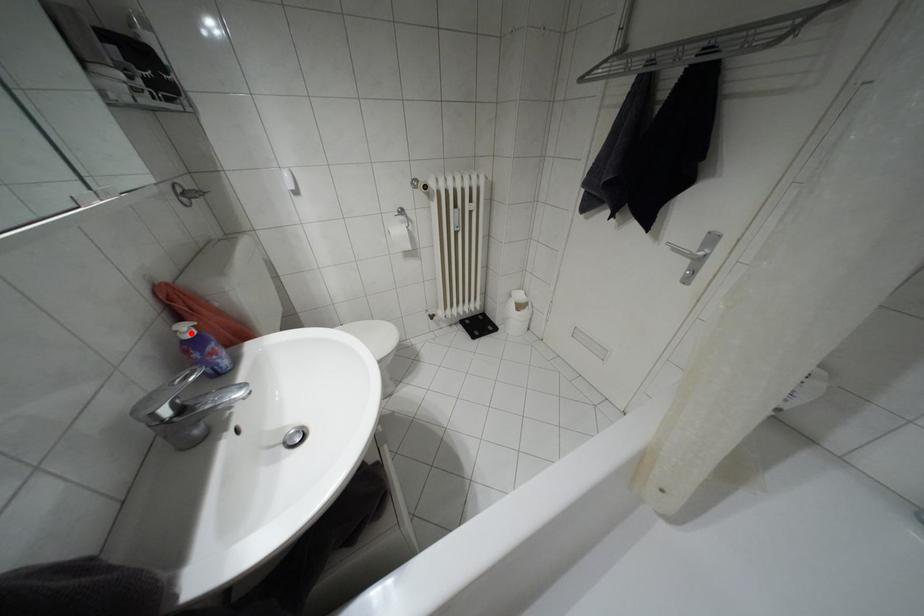
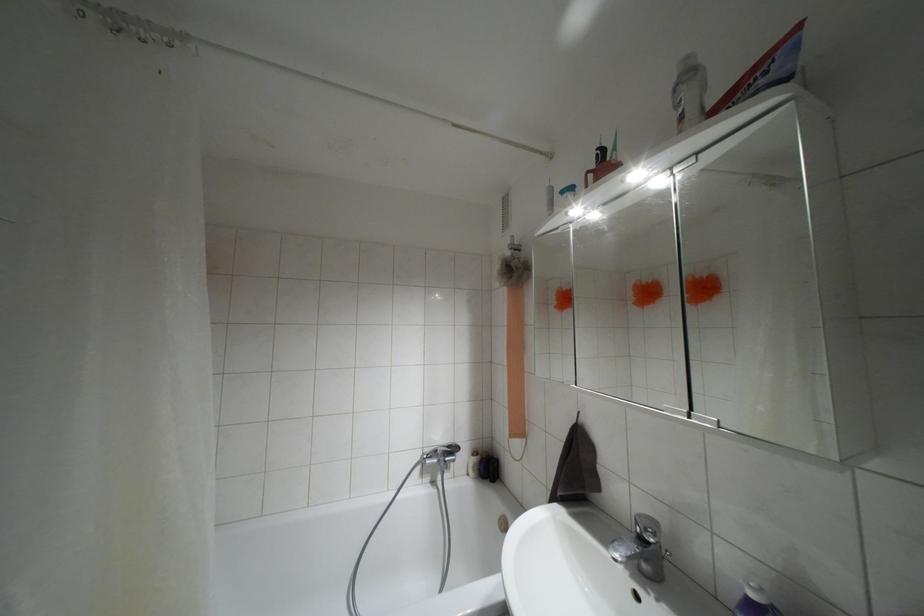
In the second image, find the point that corresponds to the highlighted location in the first image.

(751, 594)